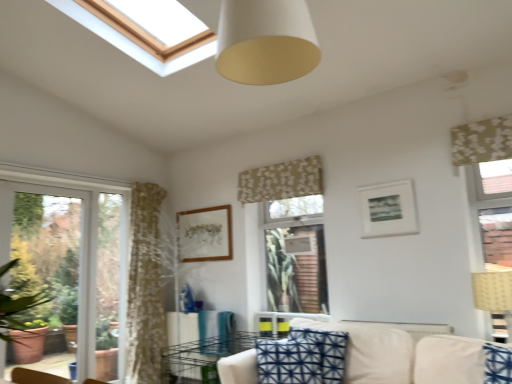
This screenshot has height=384, width=512. I want to click on vacant space situated above green floral fabric curtain at upper right, which is the 2th curtain from back to front (from a real-world perspective), so click(477, 121).